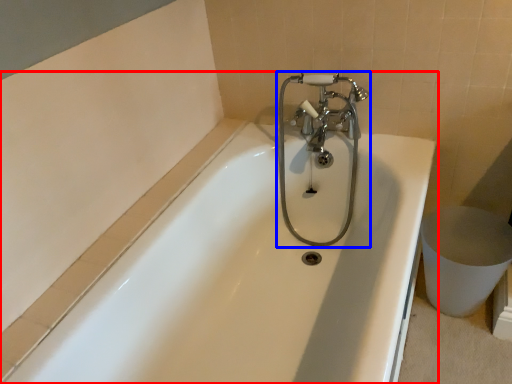
Question: Which object is closer to the camera taking this photo, bathtub (highlighted by a red box) or tap (highlighted by a blue box)?

Choices:
 (A) bathtub
 (B) tap

Answer: (A)